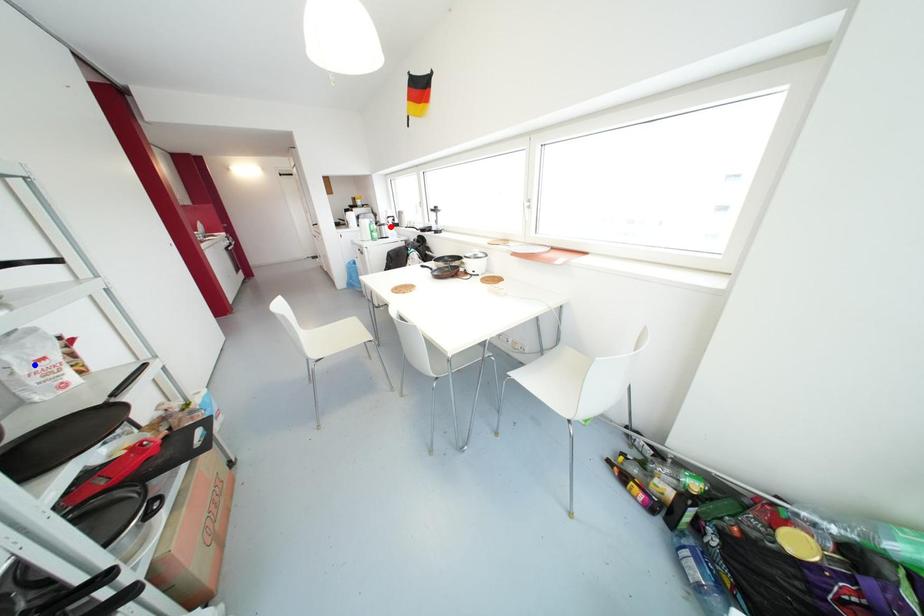
Question: In the image, two points are highlighted. Which point is nearer to the camera? Reply with the corresponding letter.

Choices:
 (A) blue point
 (B) red point

Answer: (A)